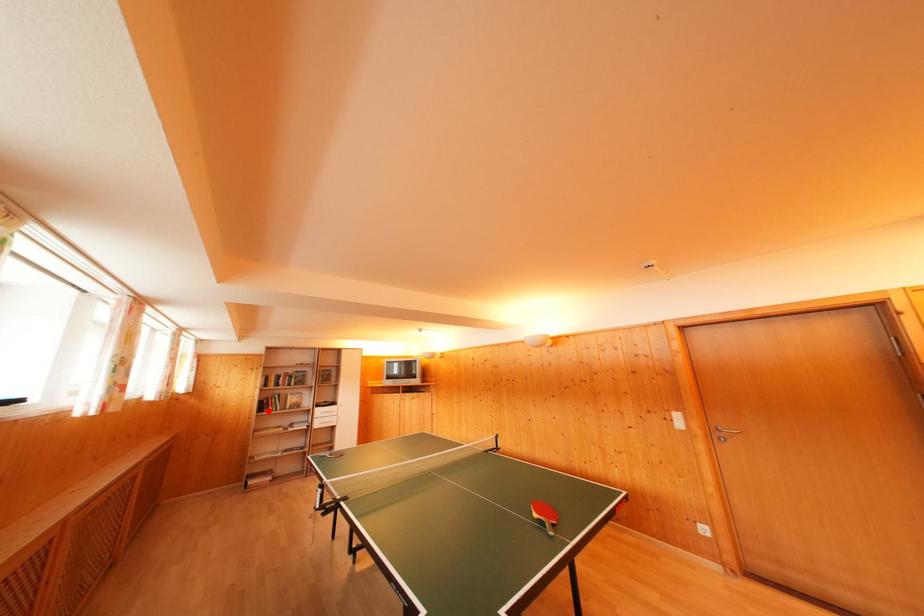
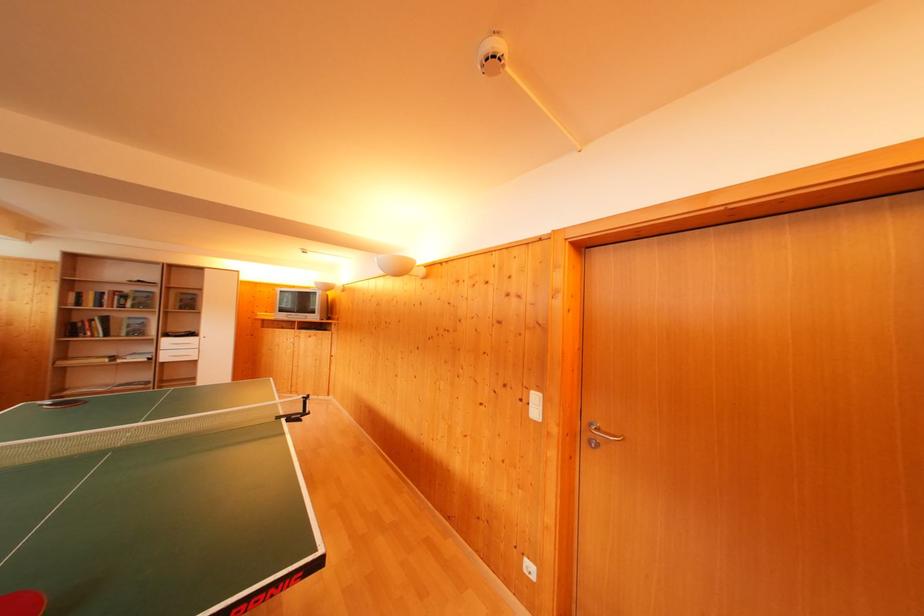
Locate, in the second image, the point that corresponds to the highlighted location in the first image.

(76, 334)